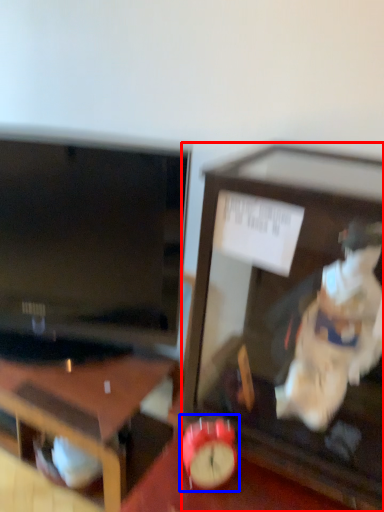
Question: Among these objects, which one is nearest to the camera, furniture (highlighted by a red box) or alarm clock (highlighted by a blue box)?

Choices:
 (A) furniture
 (B) alarm clock

Answer: (A)